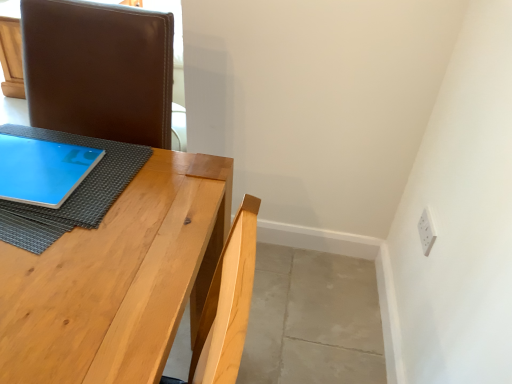
Find the location of a particular element. The height and width of the screenshot is (384, 512). vacant space to the right of matte blue tablet at left is located at coordinates (108, 187).